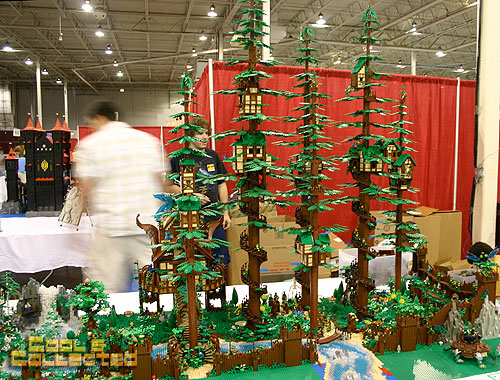
I want to click on cardboard boxes, so click(278, 233), click(280, 257), click(272, 212), click(438, 232).